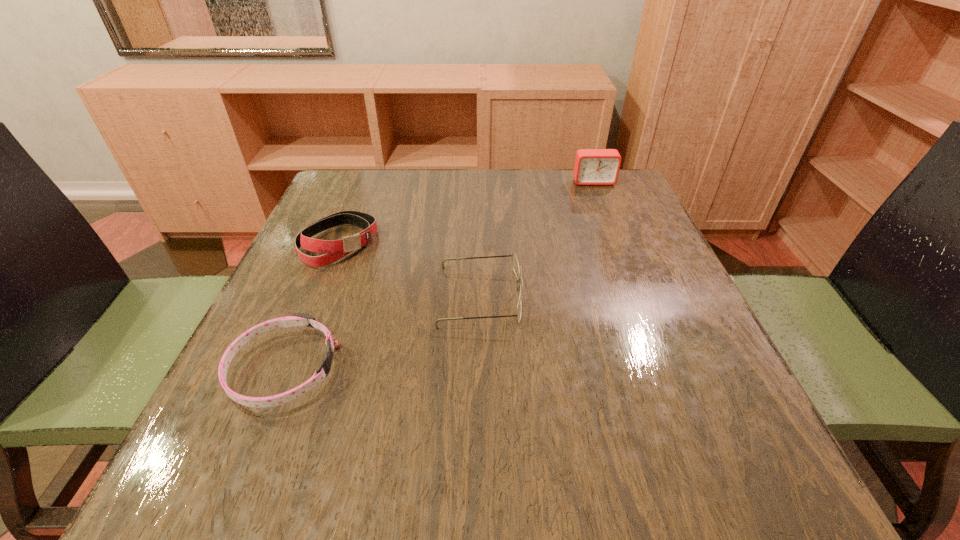
Where is `vacant space that is in between the third object from left to right and the nearer dog collar`? vacant space that is in between the third object from left to right and the nearer dog collar is located at coordinates (382, 333).

This screenshot has width=960, height=540. Find the location of `vacant space in between the nearest object and the third object from left to right`. vacant space in between the nearest object and the third object from left to right is located at coordinates (382, 333).

You are a GUI agent. You are given a task and a screenshot of the screen. Output one action in this format:
    pyautogui.click(x=<x>, y=<y>)
    Task: Click on the free spot between the tallest object and the taller dog collar
    This screenshot has width=960, height=540.
    Given the screenshot: What is the action you would take?
    pyautogui.click(x=466, y=213)

You are a GUI agent. You are given a task and a screenshot of the screen. Output one action in this format:
    pyautogui.click(x=<x>, y=<y>)
    Task: Click on the vacant space that is in between the farther dog collar and the spectacles
    
    Given the screenshot: What is the action you would take?
    pyautogui.click(x=409, y=270)

Identify the location of free space between the nearest object and the tallest object. Image resolution: width=960 pixels, height=540 pixels. (439, 275).

Where is `empty location between the rightmost object and the farther dog collar`? Image resolution: width=960 pixels, height=540 pixels. empty location between the rightmost object and the farther dog collar is located at coordinates (466, 213).

The image size is (960, 540). I want to click on free space between the rightmost object and the spectacles, so click(x=537, y=239).

You are a GUI agent. You are given a task and a screenshot of the screen. Output one action in this format:
    pyautogui.click(x=<x>, y=<y>)
    Task: Click on the free space that is in between the third object from left to right and the farther dog collar
    The height and width of the screenshot is (540, 960).
    Given the screenshot: What is the action you would take?
    pos(409,270)

In order to click on vacant area that lies between the shorter dog collar and the second object from right to left in this screenshot , I will do `click(382, 333)`.

Identify which object is located as the third nearest to the farther dog collar. Please provide its 2D coordinates. Your answer should be formatted as a tuple, i.e. [(x, y)], where the tuple contains the x and y coordinates of a point satisfying the conditions above.

[(592, 166)]